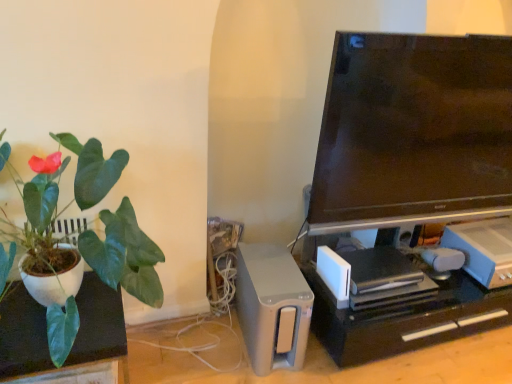
Question: Considering the relative sizes of white matte plant pot at left and white plastic game console at lower right, which is the second appliance in left-to-right order, in the image provided, is white matte plant pot at left shorter than white plastic game console at lower right, which is the second appliance in left-to-right order,?

Choices:
 (A) no
 (B) yes

Answer: (A)

Question: Does white matte plant pot at left come behind white plastic game console at lower right, which is the second appliance in left-to-right order?

Choices:
 (A) no
 (B) yes

Answer: (A)

Question: Is white matte plant pot at left looking in the opposite direction of white plastic game console at lower right, which is the second appliance in left-to-right order?

Choices:
 (A) yes
 (B) no

Answer: (B)

Question: Are white matte plant pot at left and white plastic game console at lower right, which is the second appliance in left-to-right order, far apart?

Choices:
 (A) yes
 (B) no

Answer: (A)

Question: Is white matte plant pot at left closer to the viewer compared to white plastic game console at lower right, the 1th appliance positioned from the right?

Choices:
 (A) no
 (B) yes

Answer: (B)

Question: From the image's perspective, is matte white pot at left located above or below black plastic computer desk at lower right?

Choices:
 (A) below
 (B) above

Answer: (B)

Question: From a real-world perspective, relative to black plastic computer desk at lower right, is matte white pot at left vertically above or below?

Choices:
 (A) below
 (B) above

Answer: (B)

Question: Considering their positions, is matte white pot at left located in front of or behind black plastic computer desk at lower right?

Choices:
 (A) behind
 (B) front

Answer: (B)

Question: Considering the positions of matte white pot at left and black plastic computer desk at lower right in the image, is matte white pot at left wider or thinner than black plastic computer desk at lower right?

Choices:
 (A) thin
 (B) wide

Answer: (B)

Question: From the image's perspective, is white matte plant pot at left located above or below satin silver speaker at lower center, the second appliance in the right-to-left sequence?

Choices:
 (A) below
 (B) above

Answer: (A)

Question: Is white matte plant pot at left wider or thinner than satin silver speaker at lower center, the second appliance in the right-to-left sequence?

Choices:
 (A) thin
 (B) wide

Answer: (A)

Question: In terms of size, does white matte plant pot at left appear bigger or smaller than satin silver speaker at lower center, the first appliance viewed from the left?

Choices:
 (A) big
 (B) small

Answer: (A)

Question: Is white matte plant pot at left in front of or behind satin silver speaker at lower center, the second appliance in the right-to-left sequence, in the image?

Choices:
 (A) front
 (B) behind

Answer: (A)

Question: From the image's perspective, relative to black plastic computer desk at lower right, is white plastic game console at lower right, which is the second appliance in left-to-right order, above or below?

Choices:
 (A) above
 (B) below

Answer: (A)

Question: Considering the relative positions of white plastic game console at lower right, which is the second appliance in left-to-right order, and black plastic computer desk at lower right in the image provided, is white plastic game console at lower right, which is the second appliance in left-to-right order, to the left or to the right of black plastic computer desk at lower right?

Choices:
 (A) right
 (B) left

Answer: (A)